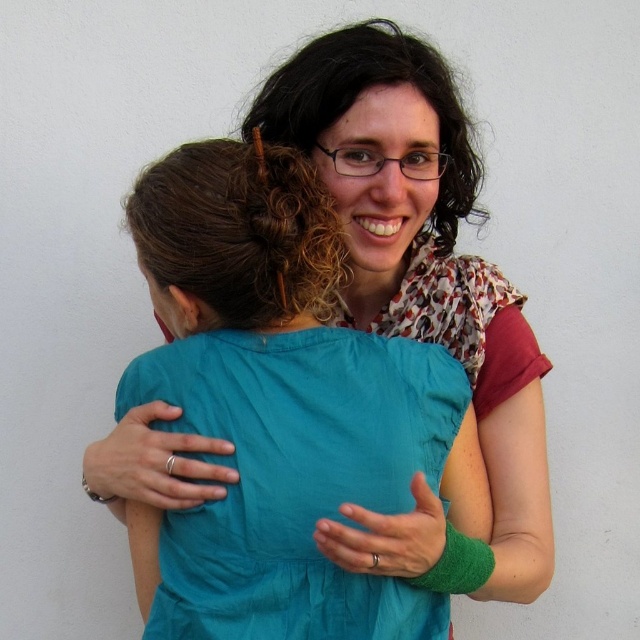
You are a photographer who needs to adjust the lighting to highlight both the matte teal dress at center and the teal fabric dress at center. Since the background is plain and white, which dress should you focus the light on to ensure it stands out more?

The matte teal dress at center is positioned on the right side of the teal fabric dress at center. Since matte surfaces reflect light less evenly than fabric, focusing the light on the matte teal dress at center would help it stand out against the white background.

You are an interior designer planning to place a decorative item at point 0.5, 0.6. Considering the position of the matte teal dress at center, which is at point 0.458, 0.659, will the dress be in the way of the decorative item?

The matte teal dress at center is located at point [420,292], which is very close to the desired placement point of [384,320]. Depending on the size of the decorative item and the dress, there might be an overlap or obstruction. However, since the coordinates are slightly offset, the dress may not completely block the area. Further consideration of their sizes would be needed to determine if they interfere.

You are a photographer adjusting the lighting for a photo shoot. The scene has two dresses at the center of the image, a matte teal dress at center and a teal fabric dress at center. You need to ensure they are spaced exactly 5 inches apart for the composition. Based on the current setup, will you need to move them closer or farther apart?

The distance between the matte teal dress at center and the teal fabric dress at center is currently 5.24 inches. Since 5.24 inches is slightly more than 5 inches, you should move them closer to achieve the desired spacing.